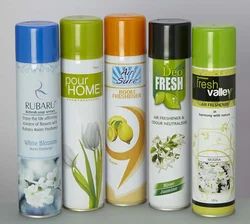
You are a GUI agent. You are given a task and a screenshot of the screen. Output one action in this format:
    pyautogui.click(x=<x>, y=<y>)
    Task: Click on the right canister
    
    Given the screenshot: What is the action you would take?
    pyautogui.click(x=207, y=123)